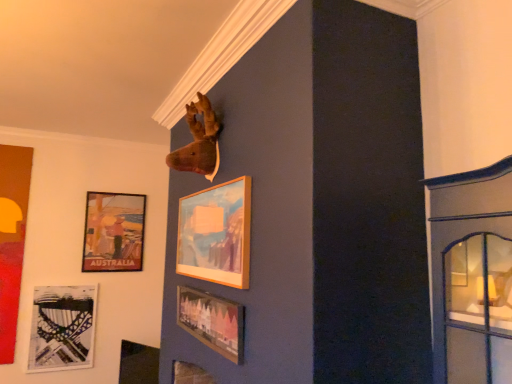
Question: From a real-world perspective, is wooden frame at upper center, the 2th picture frame viewed from the front, under matte cardboard poster at upper left, placed as the fifth picture frame when sorted from front to back?

Choices:
 (A) yes
 (B) no

Answer: (A)

Question: Is wooden frame at upper center, which appears as the 4th picture frame when viewed from the back, positioned beyond the bounds of matte cardboard poster at upper left, the first picture frame positioned from the back?

Choices:
 (A) no
 (B) yes

Answer: (B)

Question: Can you confirm if wooden frame at upper center, the 2th picture frame viewed from the front, is thinner than matte cardboard poster at upper left, placed as the fifth picture frame when sorted from front to back?

Choices:
 (A) yes
 (B) no

Answer: (A)

Question: Would you consider wooden frame at upper center, which appears as the 4th picture frame when viewed from the back, to be distant from matte cardboard poster at upper left, the first picture frame positioned from the back?

Choices:
 (A) yes
 (B) no

Answer: (A)

Question: Is wooden frame at upper center, which appears as the 4th picture frame when viewed from the back, positioned before matte cardboard poster at upper left, the first picture frame positioned from the back?

Choices:
 (A) yes
 (B) no

Answer: (A)

Question: Does wooden frame at upper center, which appears as the 4th picture frame when viewed from the back, lie behind matte cardboard poster at upper left, placed as the fifth picture frame when sorted from front to back?

Choices:
 (A) yes
 (B) no

Answer: (B)

Question: Is matte black harp at lower left, which is counted as the second picture frame, starting from the back, oriented away from matte cardboard poster at upper left, the first picture frame positioned from the back?

Choices:
 (A) no
 (B) yes

Answer: (A)

Question: Is matte black harp at lower left, the 4th picture frame in the front-to-back sequence, next to matte cardboard poster at upper left, the first picture frame positioned from the back, and touching it?

Choices:
 (A) no
 (B) yes

Answer: (A)

Question: From a real-world perspective, is matte black harp at lower left, the 4th picture frame in the front-to-back sequence, physically above matte cardboard poster at upper left, the first picture frame positioned from the back?

Choices:
 (A) no
 (B) yes

Answer: (A)

Question: Can you confirm if matte black harp at lower left, the 4th picture frame in the front-to-back sequence, is thinner than matte cardboard poster at upper left, the first picture frame positioned from the back?

Choices:
 (A) yes
 (B) no

Answer: (A)

Question: Is matte black harp at lower left, which is counted as the second picture frame, starting from the back, far from matte cardboard poster at upper left, the first picture frame positioned from the back?

Choices:
 (A) yes
 (B) no

Answer: (B)

Question: Is the depth of matte black harp at lower left, which is counted as the second picture frame, starting from the back, less than that of matte cardboard poster at upper left, the first picture frame positioned from the back?

Choices:
 (A) yes
 (B) no

Answer: (A)

Question: From the image's perspective, would you say matte black harp at lower left, which is counted as the second picture frame, starting from the back, is positioned over matte wooden picture frame at lower center, which is the 1th picture frame from front to back?

Choices:
 (A) no
 (B) yes

Answer: (A)